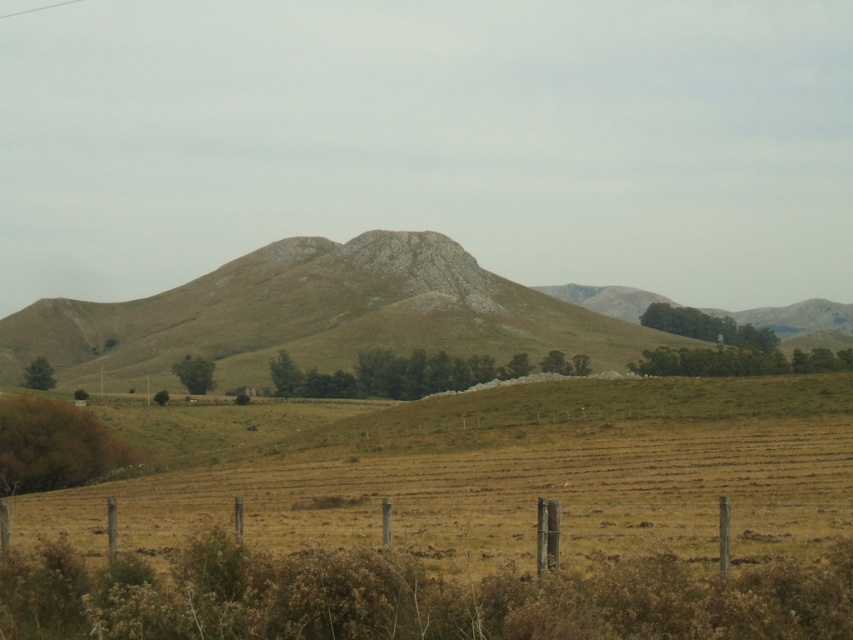
Can you confirm if dry grassland at center is smaller than rugged brown mountain at center?

Correct, dry grassland at center occupies less space than rugged brown mountain at center.

Who is taller, dry grassland at center or rugged brown mountain at center?

rugged brown mountain at center is taller.

Who is more distant from viewer, (407, 433) or (231, 272)?

The point (231, 272) is behind.

This screenshot has height=640, width=853. I want to click on dry grassland at center, so click(509, 474).

Which of these two, rugged brown mountain at center or brown wooden fence at lower center, stands shorter?

Standing shorter between the two is brown wooden fence at lower center.

Is point (601, 314) positioned before point (705, 518)?

No, (601, 314) is further to viewer.

The height and width of the screenshot is (640, 853). Describe the element at coordinates (316, 316) in the screenshot. I see `rugged brown mountain at center` at that location.

Identify the location of rugged brown mountain at center. The image size is (853, 640). (316, 316).

In the scene shown: Who is positioned more to the right, dry grassland at center or brown wooden fence at lower center?

Positioned to the right is dry grassland at center.

Is dry grassland at center behind brown wooden fence at lower center?

That is True.

Who is more distant from viewer, [421,508] or [573,534]?

Positioned behind is point [421,508].

The height and width of the screenshot is (640, 853). Identify the location of dry grassland at center. (509, 474).